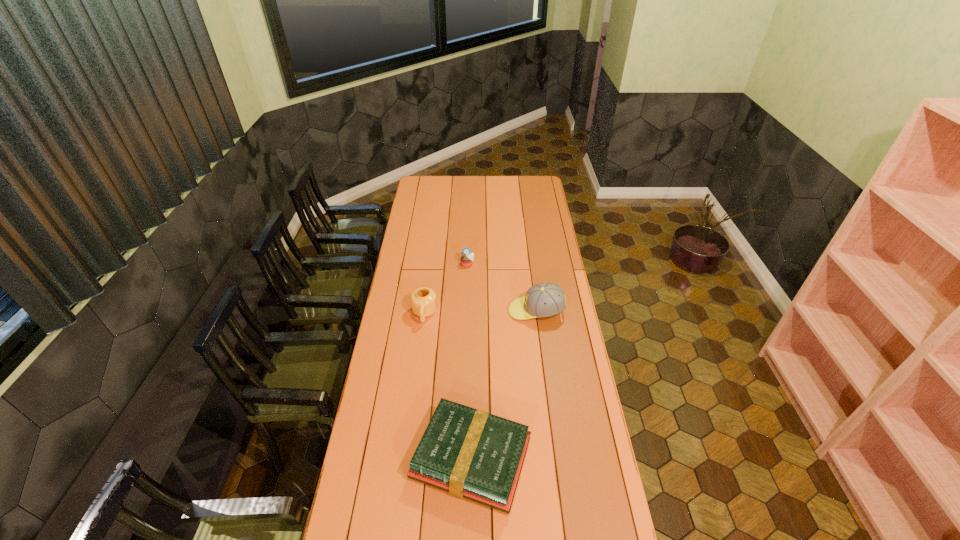
Where is `object situated at the left edge`? The height and width of the screenshot is (540, 960). object situated at the left edge is located at coordinates (423, 300).

At what (x,y) coordinates should I click in order to perform the action: click on object positioned at the right edge. Please return your answer as a coordinate pair (x, y). The width and height of the screenshot is (960, 540). Looking at the image, I should click on (542, 300).

Where is `vacant region at the far edge`? Image resolution: width=960 pixels, height=540 pixels. vacant region at the far edge is located at coordinates tap(483, 187).

This screenshot has height=540, width=960. I want to click on vacant space at the left edge of the desktop, so click(414, 241).

Identify the location of free space at the right edge of the desktop. (559, 281).

I want to click on vacant space at the far right corner, so click(x=524, y=183).

Image resolution: width=960 pixels, height=540 pixels. In order to click on free space between the mug and the tallest object in this screenshot , I will do `click(480, 312)`.

At what (x,y) coordinates should I click in order to perform the action: click on free space that is in between the mug and the nearest object. Please return your answer as a coordinate pair (x, y). The image size is (960, 540). Looking at the image, I should click on (447, 386).

Find the location of a particular element. free space between the baseball cap and the muffin is located at coordinates (502, 288).

This screenshot has height=540, width=960. Identify the location of unoccupied area between the muffin and the mug. (446, 289).